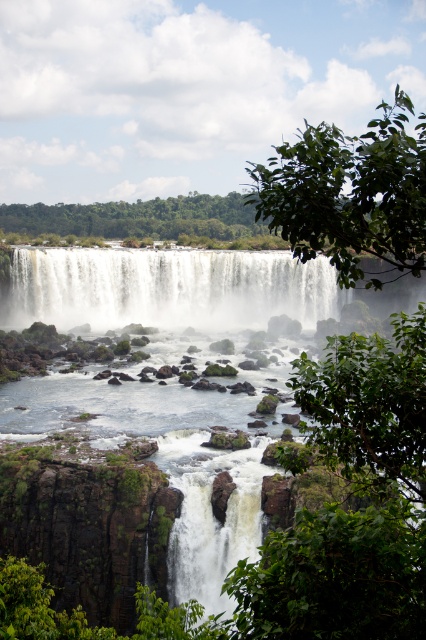
You are a photographer planning to capture the white misty water at center and the white misty waterfall at center in one frame. Which of these two objects appears bigger in the scene?

The white misty water at center appears bigger than the white misty waterfall at center in the scene.

You are standing at the edge of the waterfall and want to take a photo of the white misty water at center. Based on its position, where should you aim your camera to capture it?

The white misty water at center is located at point (88,524), so you should aim your camera towards that coordinate to capture it.

You are a photographer planning to capture the white misty water at center and the white misty waterfall at center in a single shot. Which of these two objects will appear taller in the final photograph?

The white misty water at center will appear taller than the white misty waterfall at center in the photograph because it has a greater height compared to the white misty waterfall at center.